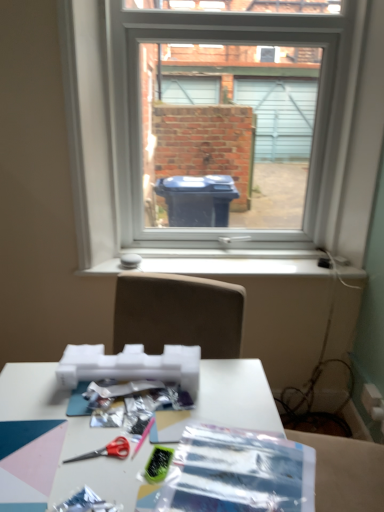
The image size is (384, 512). Identify the location of blank space situated above translucent plastic wrapping paper at center (from a real-world perspective). (231, 470).